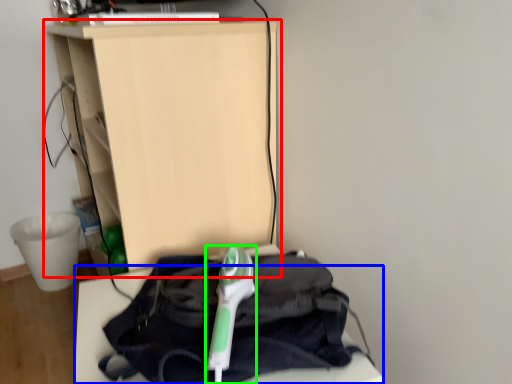
Question: Estimate the real-world distances between objects in this image. Which object is farther from furniture (highlighted by a red box), furniture (highlighted by a blue box) or equipment (highlighted by a green box)?

Choices:
 (A) furniture
 (B) equipment

Answer: (A)